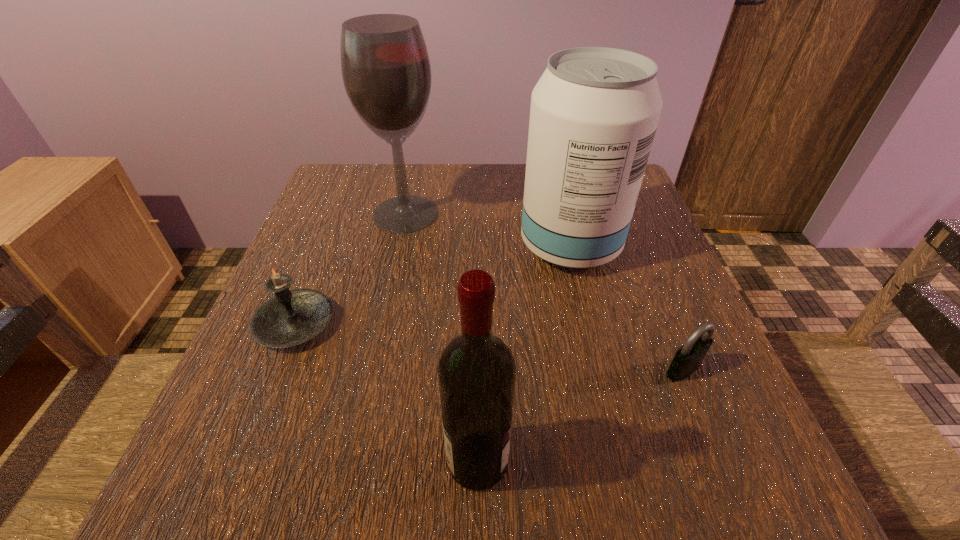
Where is `the fourth object from right to left`? The width and height of the screenshot is (960, 540). the fourth object from right to left is located at coordinates (386, 71).

You are a GUI agent. You are given a task and a screenshot of the screen. Output one action in this format:
    pyautogui.click(x=<x>, y=<y>)
    Task: Click on the rightmost alcohol
    The image size is (960, 540).
    Given the screenshot: What is the action you would take?
    pyautogui.click(x=594, y=112)

You are a GUI agent. You are given a task and a screenshot of the screen. Output one action in this format:
    pyautogui.click(x=<x>, y=<y>)
    Task: Click on the second alcohol from right to left
    This screenshot has height=540, width=960.
    Given the screenshot: What is the action you would take?
    pyautogui.click(x=476, y=372)

You are a GUI agent. You are given a task and a screenshot of the screen. Output one action in this format:
    pyautogui.click(x=<x>, y=<y>)
    Task: Click on the nearest alcohol
    The width and height of the screenshot is (960, 540).
    Given the screenshot: What is the action you would take?
    pyautogui.click(x=476, y=372)

This screenshot has width=960, height=540. I want to click on the third farthest object, so click(x=292, y=317).

Where is `the leftmost object`? The width and height of the screenshot is (960, 540). the leftmost object is located at coordinates (292, 317).

The width and height of the screenshot is (960, 540). I want to click on padlock, so (x=688, y=358).

Image resolution: width=960 pixels, height=540 pixels. I want to click on the second nearest object, so click(x=688, y=358).

I want to click on vacant region located on the right of the fourth object from right to left, so click(495, 214).

Find the location of a particular element. The width and height of the screenshot is (960, 540). free space located on the front of the rightmost alcohol is located at coordinates (589, 326).